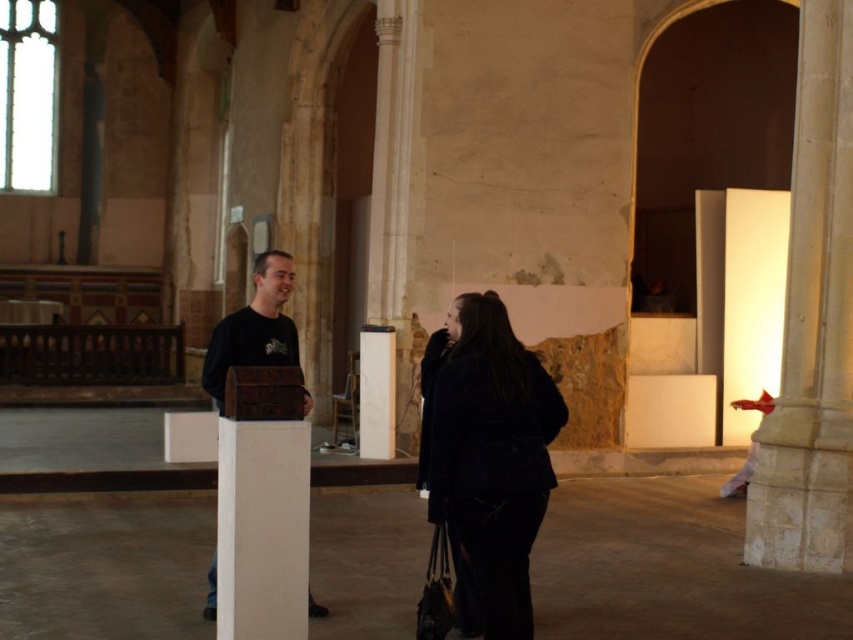
Question: Which point is farther to the camera?

Choices:
 (A) (498, 524)
 (B) (225, 339)

Answer: (B)

Question: Does dark blue wool coat at center come behind brown leather chest at center?

Choices:
 (A) no
 (B) yes

Answer: (B)

Question: Can you confirm if dark blue wool coat at center is positioned above brown leather chest at center?

Choices:
 (A) no
 (B) yes

Answer: (A)

Question: Is dark blue wool coat at center above brown leather chest at center?

Choices:
 (A) yes
 (B) no

Answer: (B)

Question: Among these points, which one is nearest to the camera?

Choices:
 (A) (293, 348)
 (B) (445, 355)

Answer: (B)